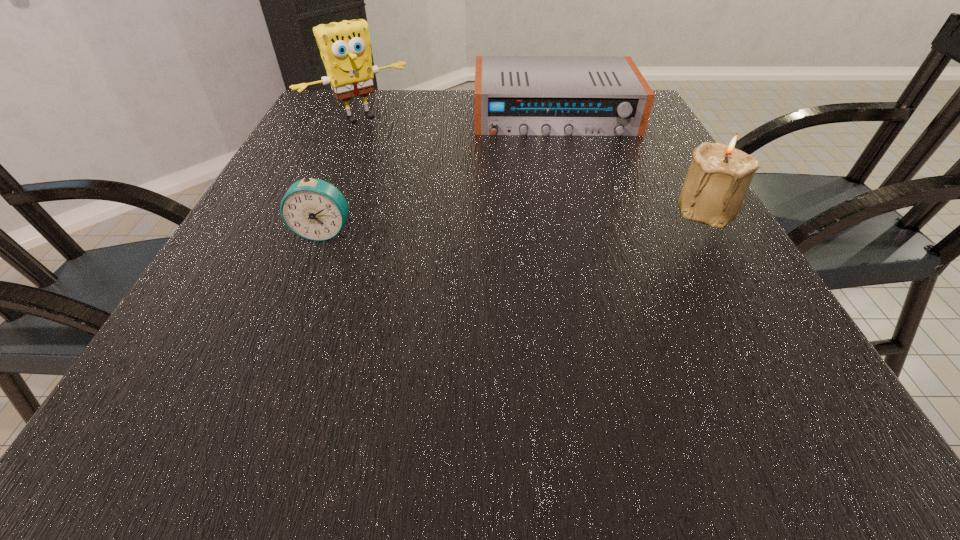
Identify the location of vacant space on the desktop that is between the alarm clock and the second tallest object and is positioned on the face of the sponge. (468, 224).

The width and height of the screenshot is (960, 540). Identify the location of vacant space on the desktop that is between the alarm clock and the candle_holder and is positioned on the front panel of the shortest object. (579, 217).